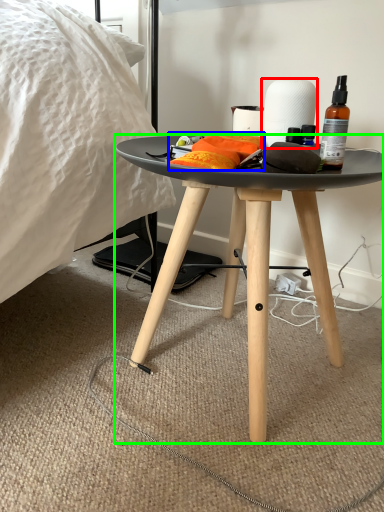
Question: Based on their relative distances, which object is farther from paper towel (highlighted by a red box)? Choose from material (highlighted by a blue box) and desk (highlighted by a green box).

Choices:
 (A) material
 (B) desk

Answer: (B)